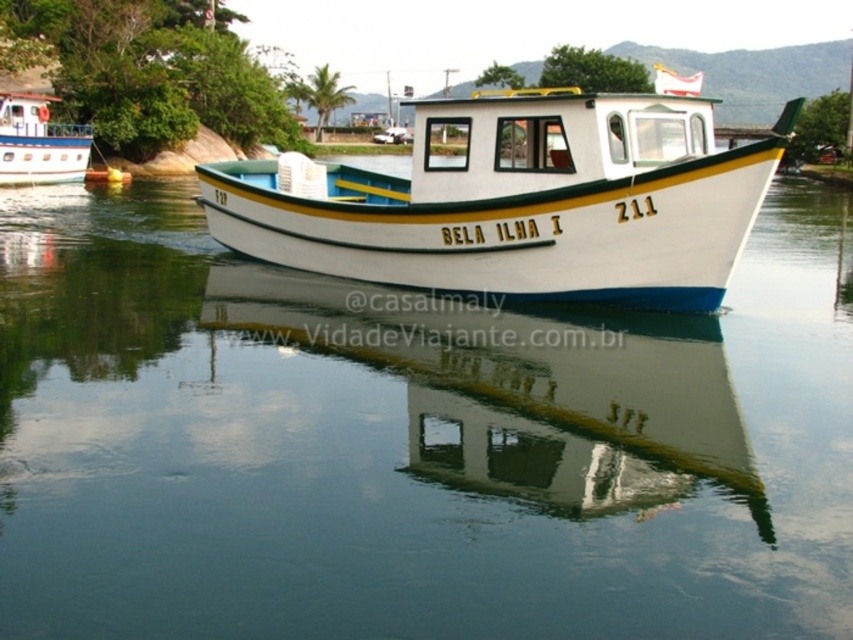
Question: Estimate the real-world distances between objects in this image. Which object is closer to the smooth water at center?

Choices:
 (A) white glossy boat at upper left
 (B) white glossy boat at center

Answer: (B)

Question: Based on their relative distances, which object is farther from the white glossy boat at upper left?

Choices:
 (A) white glossy boat at center
 (B) smooth water at center

Answer: (A)

Question: Observing the image, what is the correct spatial positioning of smooth water at center in reference to white glossy boat at center?

Choices:
 (A) right
 (B) left

Answer: (B)

Question: Which is farther from the white glossy boat at upper left?

Choices:
 (A) white glossy boat at center
 (B) smooth water at center

Answer: (A)

Question: Can you confirm if smooth water at center is wider than white glossy boat at upper left?

Choices:
 (A) no
 (B) yes

Answer: (B)

Question: Is white glossy boat at center in front of white glossy boat at upper left?

Choices:
 (A) no
 (B) yes

Answer: (B)